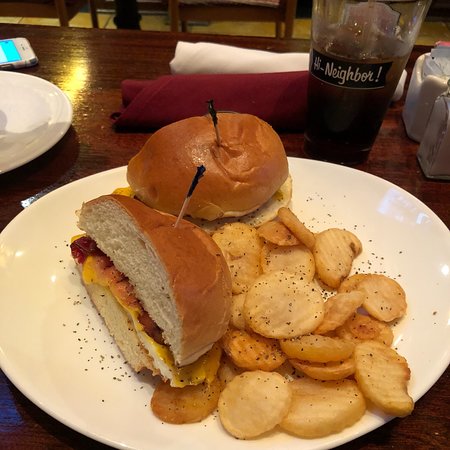
Where is `white plate`? This screenshot has width=450, height=450. white plate is located at coordinates (44, 341), (425, 264).